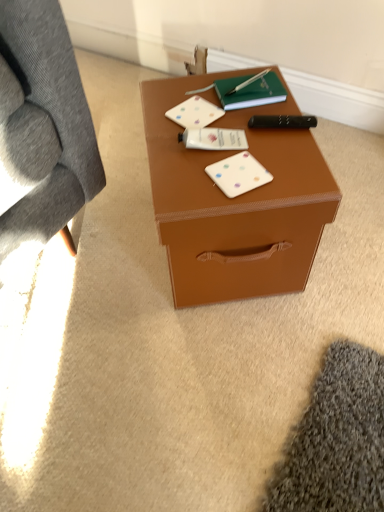
In order to click on free space in front of white matte card game at center, the first card game in the back-to-front sequence in this screenshot , I will do `click(199, 165)`.